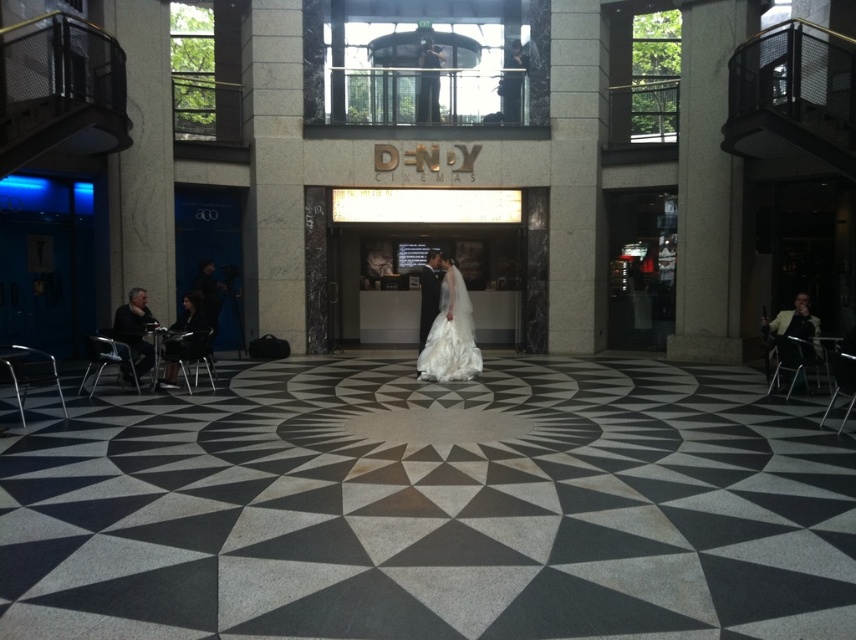
Can you confirm if white satin dress at center is wider than dark gray fabric jacket at left?

Yes.

Between white satin dress at center and dark gray fabric jacket at left, which one is positioned higher?

Positioned higher is white satin dress at center.

What do you see at coordinates (450, 333) in the screenshot?
I see `white satin dress at center` at bounding box center [450, 333].

Where is `white satin dress at center`? white satin dress at center is located at coordinates [450, 333].

Which is in front, point (290, 385) or point (191, 333)?

Positioned in front is point (191, 333).

Is black textured carpet at center below black leather jacket at lower left?

Yes.

Does point (171, 419) lie in front of point (183, 337)?

That is True.

What are the coordinates of `black textured carpet at center` in the screenshot? It's located at (432, 508).

Does black textured carpet at center lie behind light brown leather chair at right?

That is False.

Does point (241, 563) lie in front of point (816, 321)?

Yes, it is in front of point (816, 321).

Who is more distant from viewer, (x=773, y=564) or (x=794, y=296)?

The point (x=794, y=296) is more distant.

This screenshot has height=640, width=856. I want to click on black textured carpet at center, so click(x=432, y=508).